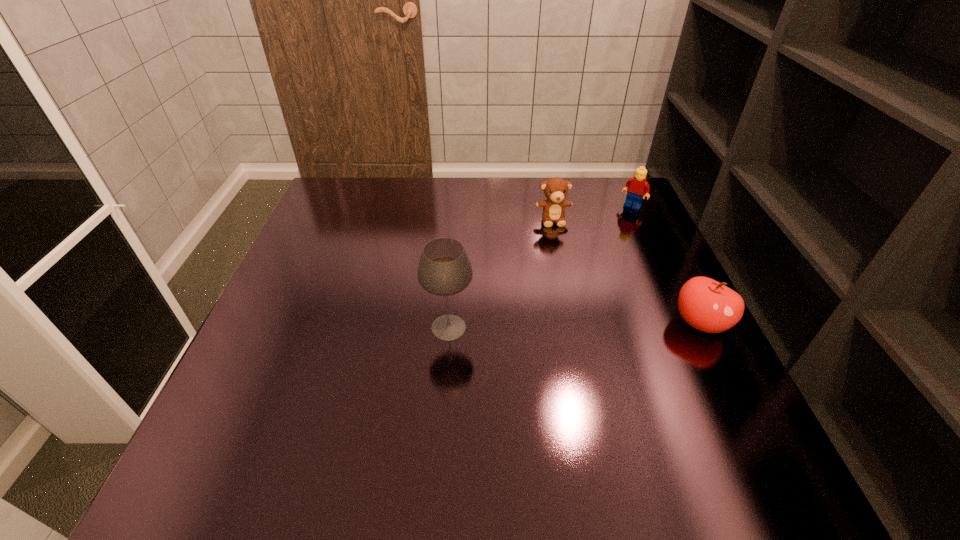
Identify the location of free space on the desktop that is between the leftmost object and the apple and is positioned on the face of the third object from right to left. pyautogui.click(x=581, y=325).

This screenshot has width=960, height=540. Find the location of `free space on the desktop that is between the wineglass and the apple and is positioned on the front-facing side of the farthest object`. free space on the desktop that is between the wineglass and the apple and is positioned on the front-facing side of the farthest object is located at coordinates 543,326.